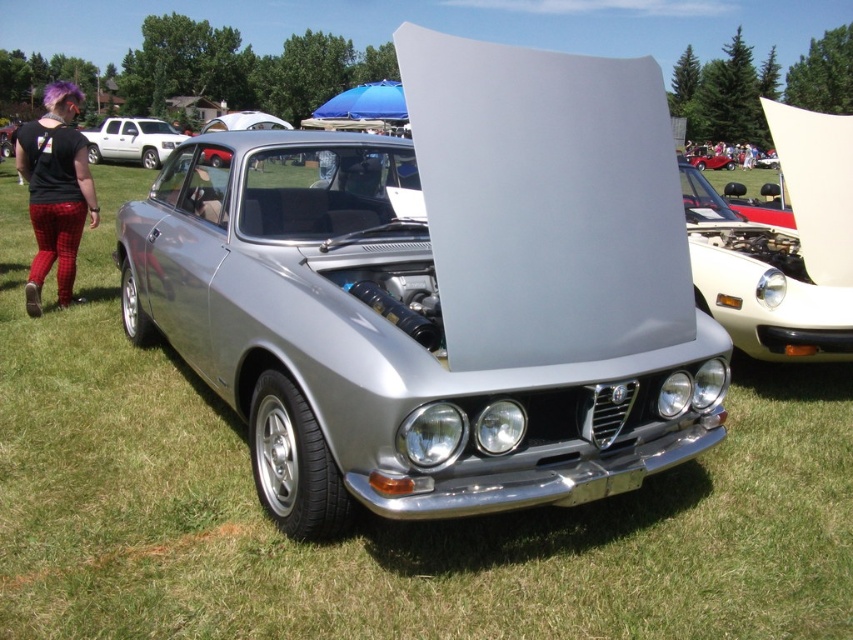
You are standing in front of the classic silver Alfa Romeo sports car parked on the grassy field. You notice two points marked on the car. Which point is closer to you, the point at coordinates point (62, 104) or point (276, 125)?

The point at coordinates point (62, 104) is closer to you than point (276, 125).

You are a photographer trying to capture the metallic red car at center and the plaid fabric pants at left in a single frame. Based on their sizes in the image, which object would appear closer to the camera?

The plaid fabric pants at left appears larger in the image, so it is closer to the camera than the metallic red car at center.